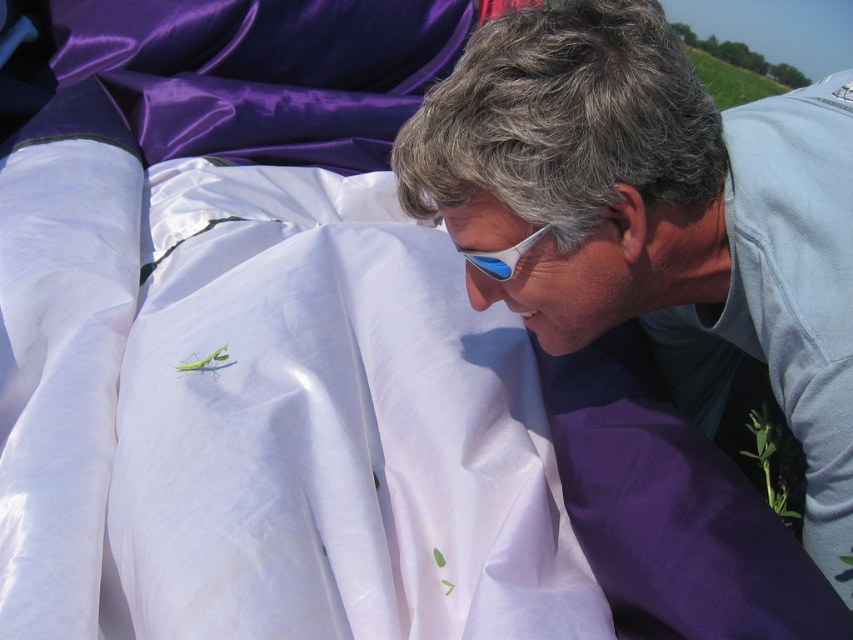
You are a photographer trying to capture the interaction between the person and the insect on the white satin blanket at center. To ensure the blanket is in the frame, where should you position your camera relative to the point marked as point [262,417]?

The white satin blanket at center is represented by point [262,417], so you should position your camera directly facing this point to ensure the blanket is centered in the frame.

You are a photographer aiming to capture a detailed closeup of the matte white shirt at center. What are the coordinates where you should focus your camera?

The coordinates to focus on are point (x=639, y=211).